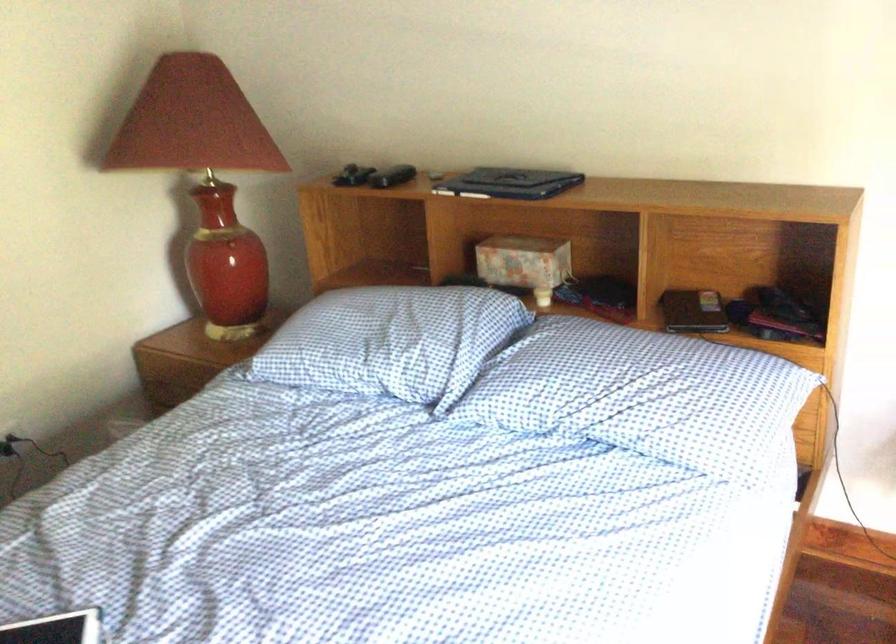
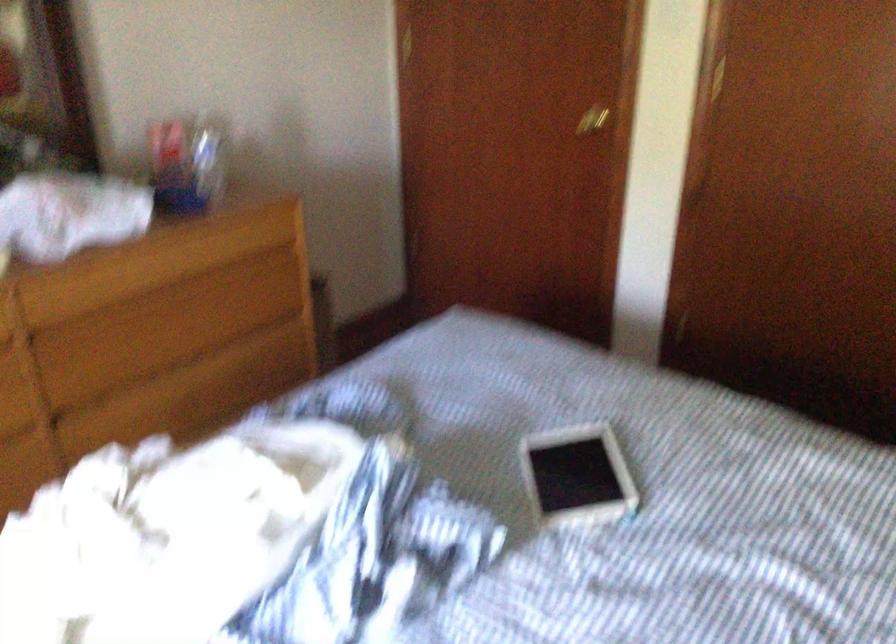
The images are taken continuously from a first-person perspective. In which direction is your viewpoint rotating?

The rotation direction of the camera is left-down.